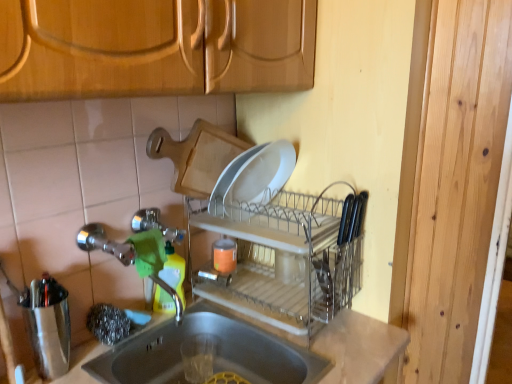
Locate an element on the screen. clear plastic dish rack at center is located at coordinates (264, 237).

Locate an element on the screen. green plastic bottle at sink is located at coordinates (174, 271).

Find the location of a particular element. smooth gray sink at lower center is located at coordinates (253, 351).

Is brushed metal shaker at left closer to camera compared to green plastic bottle at sink?

Yes.

Does brushed metal shaker at left have a greater height compared to green plastic bottle at sink?

Yes, brushed metal shaker at left is taller than green plastic bottle at sink.

Is brushed metal shaker at left oriented away from green plastic bottle at sink?

No, green plastic bottle at sink is not at the back of brushed metal shaker at left.

There is a green plastic bottle at sink. Where is `appliance above it (from a real-world perspective)`? The image size is (512, 384). appliance above it (from a real-world perspective) is located at coordinates (48, 326).

At what (x,y) coordinates should I click in order to perform the action: click on appliance beneath the clear plastic dish rack at center (from a real-world perspective). Please return your answer as a coordinate pair (x, y). The image size is (512, 384). Looking at the image, I should click on (48, 326).

Is clear plastic dish rack at center completely or partially outside of brushed metal shaker at left?

Indeed, clear plastic dish rack at center is completely outside brushed metal shaker at left.

Is clear plastic dish rack at center facing away from brushed metal shaker at left?

No, brushed metal shaker at left is not at the back of clear plastic dish rack at center.

Which object is thinner, clear plastic dish rack at center or brushed metal shaker at left?

brushed metal shaker at left is thinner.

Is smooth gray sink at lower center positioned beyond the bounds of brushed metal shaker at left?

Yes, smooth gray sink at lower center is outside of brushed metal shaker at left.

Could you tell me if smooth gray sink at lower center is facing brushed metal shaker at left?

No.

Between smooth gray sink at lower center and brushed metal shaker at left, which one is positioned behind?

brushed metal shaker at left is further away from the camera.

Is smooth gray sink at lower center touching brushed metal shaker at left?

No.

Between brushed metal shaker at left and smooth gray sink at lower center, which one appears on the left side from the viewer's perspective?

From the viewer's perspective, brushed metal shaker at left appears more on the left side.

From a real-world perspective, which is physically below, brushed metal shaker at left or smooth gray sink at lower center?

In real-world perspective, smooth gray sink at lower center is lower.

Which is in front, point (66, 301) or point (215, 309)?

Positioned in front is point (66, 301).

From the picture: Is smooth gray sink at lower center inside brushed metal shaker at left?

No.

The width and height of the screenshot is (512, 384). In the image, there is a brushed metal shaker at left. In order to click on bottle above it (from the image's perspective) in this screenshot , I will do `click(174, 271)`.

Is green plastic bottle at sink placed right next to brushed metal shaker at left?

green plastic bottle at sink and brushed metal shaker at left are clearly separated.

Is green plastic bottle at sink at the right side of brushed metal shaker at left?

Yes, green plastic bottle at sink is to the right of brushed metal shaker at left.

Considering the sizes of green plastic bottle at sink and brushed metal shaker at left in the image, is green plastic bottle at sink taller or shorter than brushed metal shaker at left?

Considering their sizes, green plastic bottle at sink has less height than brushed metal shaker at left.

Which is more to the right, clear plastic dish rack at center or smooth gray sink at lower center?

Positioned to the right is clear plastic dish rack at center.

From a real-world perspective, is clear plastic dish rack at center physically below smooth gray sink at lower center?

Actually, clear plastic dish rack at center is physically above smooth gray sink at lower center in the real world.

What's the angular difference between clear plastic dish rack at center and smooth gray sink at lower center's facing directions?

clear plastic dish rack at center and smooth gray sink at lower center are facing 92 degrees away from each other.

How distant is clear plastic dish rack at center from smooth gray sink at lower center?

clear plastic dish rack at center is 20.36 centimeters away from smooth gray sink at lower center.

From the image's perspective, relative to clear plastic dish rack at center, is smooth gray sink at lower center above or below?

Clearly, from the image's perspective, smooth gray sink at lower center is below clear plastic dish rack at center.

Does smooth gray sink at lower center have a lesser height compared to clear plastic dish rack at center?

Yes, smooth gray sink at lower center is shorter than clear plastic dish rack at center.

Is smooth gray sink at lower center positioned far away from clear plastic dish rack at center?

Actually, smooth gray sink at lower center and clear plastic dish rack at center are a little close together.

Identify the location of bottle directly beneath the brushed metal shaker at left (from a real-world perspective). The image size is (512, 384). (174, 271).

You are a GUI agent. You are given a task and a screenshot of the screen. Output one action in this format:
    pyautogui.click(x=<x>, y=<y>)
    Task: Click on the dish washer that appears above the brushed metal shaker at left (from the image's perspective)
    The image size is (512, 384).
    Given the screenshot: What is the action you would take?
    pyautogui.click(x=264, y=237)

When comparing their distances from brushed metal shaker at left, does clear plastic dish rack at center or green plastic bottle at sink seem closer?

The object closer to brushed metal shaker at left is green plastic bottle at sink.

Estimate the real-world distances between objects in this image. Which object is further from brushed metal shaker at left, green plastic bottle at sink or clear plastic dish rack at center?

Based on the image, clear plastic dish rack at center appears to be further to brushed metal shaker at left.

Estimate the real-world distances between objects in this image. Which object is closer to smooth gray sink at lower center, clear plastic dish rack at center or brushed metal shaker at left?

clear plastic dish rack at center lies closer to smooth gray sink at lower center than the other object.

Which object lies further to the anchor point clear plastic dish rack at center, smooth gray sink at lower center or brushed metal shaker at left?

brushed metal shaker at left lies further to clear plastic dish rack at center than the other object.

Looking at the image, which one is located further to clear plastic dish rack at center, brushed metal shaker at left or green plastic bottle at sink?

brushed metal shaker at left lies further to clear plastic dish rack at center than the other object.

When comparing their distances from green plastic bottle at sink, does clear plastic dish rack at center or smooth gray sink at lower center seem closer?

smooth gray sink at lower center is positioned closer to the anchor green plastic bottle at sink.

Looking at this image, looking at the image, which one is located further to clear plastic dish rack at center, smooth gray sink at lower center or green plastic bottle at sink?

Among the two, green plastic bottle at sink is located further to clear plastic dish rack at center.

Based on the photo, based on their spatial positions, is clear plastic dish rack at center or green plastic bottle at sink further from smooth gray sink at lower center?

green plastic bottle at sink is further to smooth gray sink at lower center.

The height and width of the screenshot is (384, 512). I want to click on countertop between brushed metal shaker at left and clear plastic dish rack at center, so click(x=253, y=351).

Locate an element on the screen. This screenshot has width=512, height=384. appliance between smooth gray sink at lower center and green plastic bottle at sink along the z-axis is located at coordinates (48, 326).

At what (x,y) coordinates should I click in order to perform the action: click on dish washer between smooth gray sink at lower center and green plastic bottle at sink along the z-axis. Please return your answer as a coordinate pair (x, y). Image resolution: width=512 pixels, height=384 pixels. Looking at the image, I should click on pos(264,237).

The width and height of the screenshot is (512, 384). I want to click on bottle between brushed metal shaker at left and clear plastic dish rack at center from left to right, so pyautogui.click(x=174, y=271).